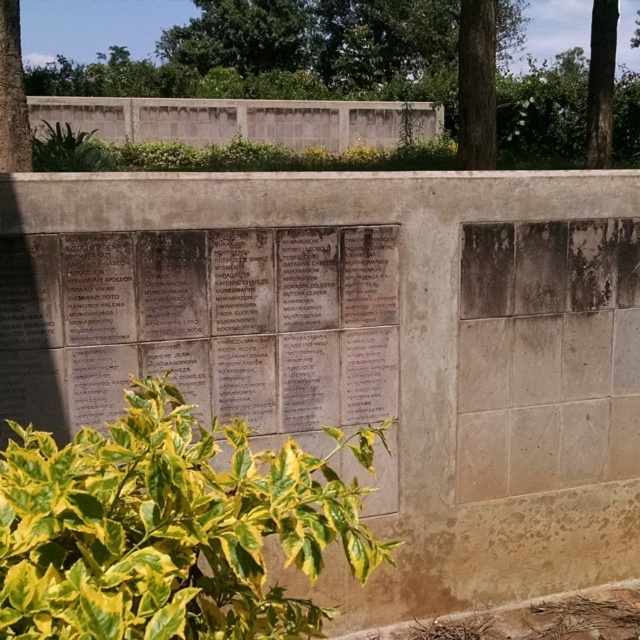
You are a visitor at the memorial wall and want to take a photo that includes both the green rough bark tree at upper right and the green leafy tree at upper left. Considering their sizes, which tree should you frame closer to the center of your photo to ensure both are visible in the frame?

The green rough bark tree at upper right is larger than the green leafy tree at upper left. To ensure both are visible, frame the larger green rough bark tree at upper right closer to the center of your photo so that the smaller green leafy tree at upper left can also fit into the frame.

You are standing in front of the memorial wall and notice a green leafy tree at upper center. Can you determine its exact position relative to the wall?

The green leafy tree at upper center is located at point coordinates of (282, 54), so it is positioned at that exact point relative to the wall.